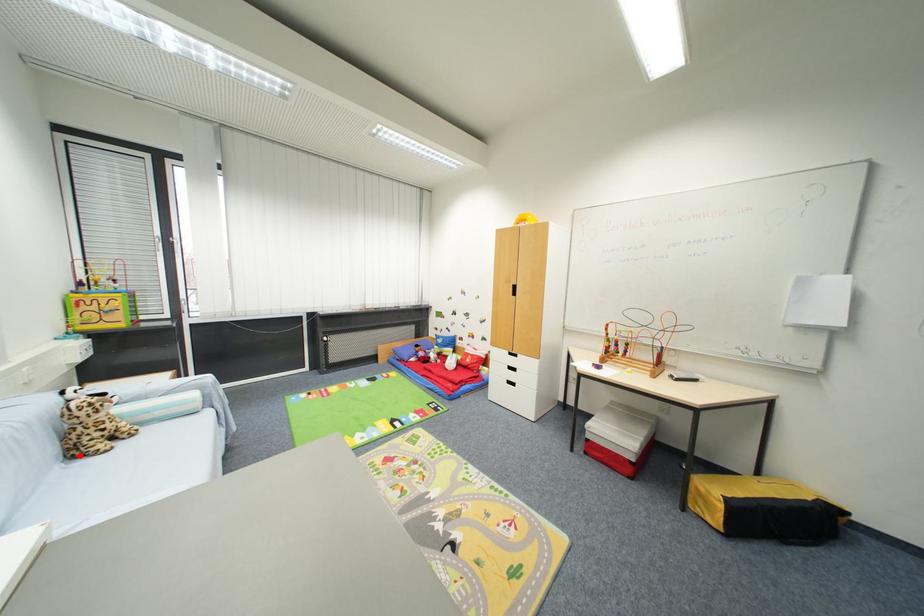
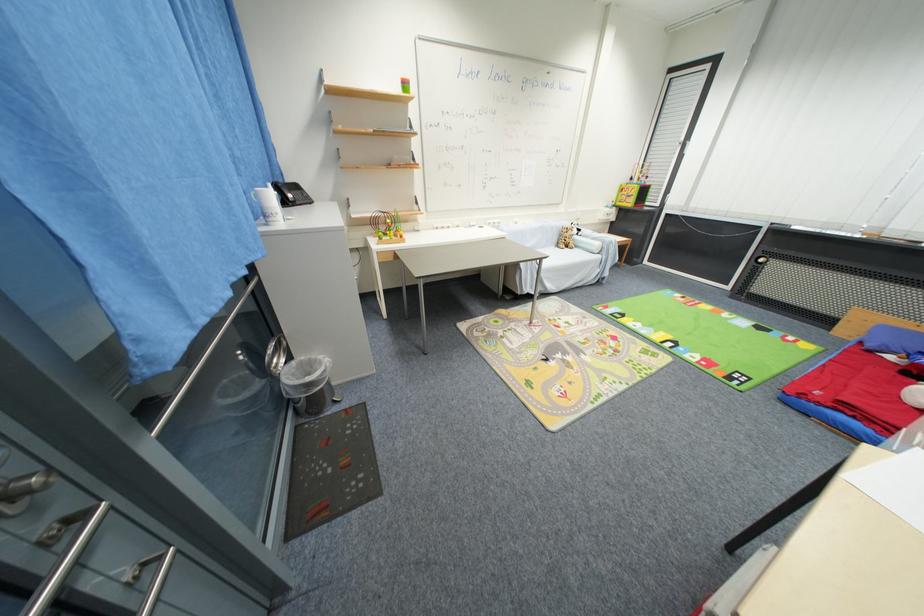
In the second image, find the point that corresponds to the highlighted location in the first image.

(563, 246)